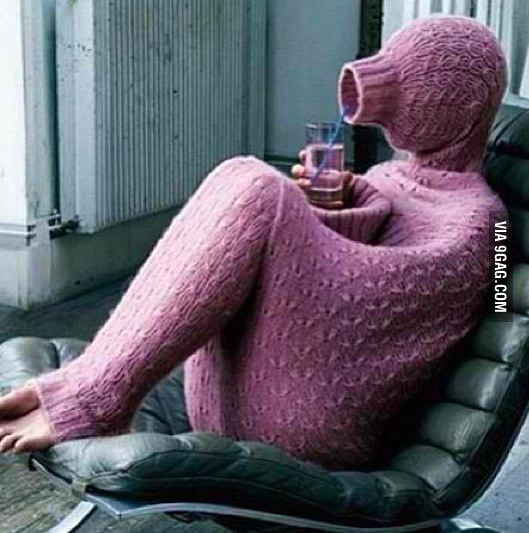
Locate an element on the screen. The height and width of the screenshot is (533, 529). glass is located at coordinates [x=324, y=124].